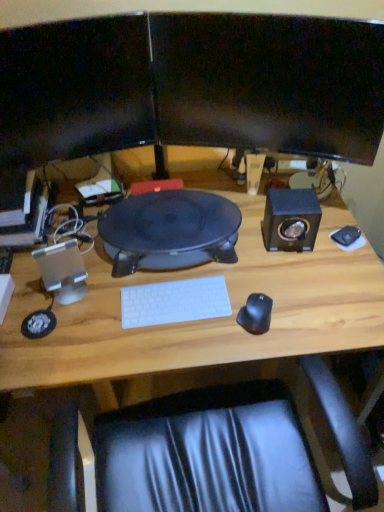
The image size is (384, 512). What are the coordinates of `empty space that is in between black matte speaker at right, which is the 2th speaker from left to right, and black matte mouse at right, positioned as the first mouse in top-to-bottom order` in the screenshot? It's located at (324, 239).